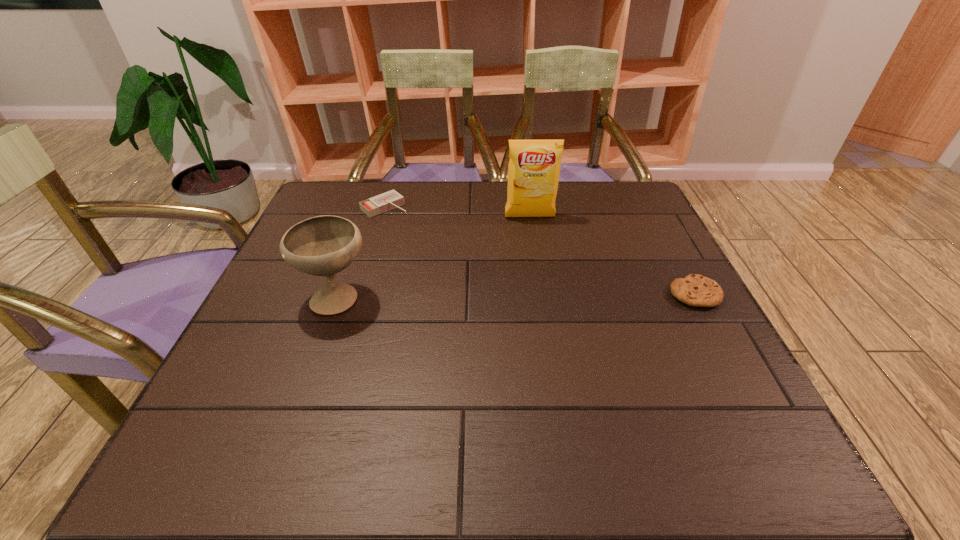
Where is `vacant space on the desktop that is between the chalice and the rightmost object and is positioned on the front of the crisp (potato chip) with the logo`? vacant space on the desktop that is between the chalice and the rightmost object and is positioned on the front of the crisp (potato chip) with the logo is located at coordinates (544, 295).

The image size is (960, 540). What are the coordinates of `vacant space on the desktop that is between the chalice and the rightmost object and is positioned on the striking surface of the matchbox` in the screenshot? It's located at (494, 295).